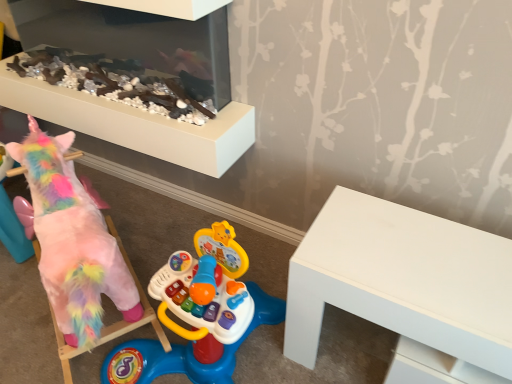
Question: Is fluffy pink unicorn at left thinner than smooth white fireplace at upper center?

Choices:
 (A) no
 (B) yes

Answer: (A)

Question: Can you confirm if fluffy pink unicorn at left is shorter than smooth white fireplace at upper center?

Choices:
 (A) no
 (B) yes

Answer: (A)

Question: Is the depth of fluffy pink unicorn at left less than that of smooth white fireplace at upper center?

Choices:
 (A) no
 (B) yes

Answer: (B)

Question: Is fluffy pink unicorn at left in contact with smooth white fireplace at upper center?

Choices:
 (A) no
 (B) yes

Answer: (A)

Question: Considering the relative positions of fluffy pink unicorn at left and smooth white fireplace at upper center in the image provided, is fluffy pink unicorn at left behind smooth white fireplace at upper center?

Choices:
 (A) yes
 (B) no

Answer: (B)

Question: Does fluffy pink unicorn at left turn towards smooth white fireplace at upper center?

Choices:
 (A) yes
 (B) no

Answer: (B)

Question: From the image's perspective, is white matte table at right over fluffy pink unicorn at left?

Choices:
 (A) yes
 (B) no

Answer: (B)

Question: Is white matte table at right aimed at fluffy pink unicorn at left?

Choices:
 (A) no
 (B) yes

Answer: (A)

Question: Can you confirm if white matte table at right is bigger than fluffy pink unicorn at left?

Choices:
 (A) no
 (B) yes

Answer: (A)

Question: Can you confirm if white matte table at right is smaller than fluffy pink unicorn at left?

Choices:
 (A) yes
 (B) no

Answer: (A)

Question: Does white matte table at right have a greater width compared to fluffy pink unicorn at left?

Choices:
 (A) yes
 (B) no

Answer: (A)

Question: Is white matte table at right directly adjacent to fluffy pink unicorn at left?

Choices:
 (A) yes
 (B) no

Answer: (B)

Question: Could you tell me if smooth white fireplace at upper center is turned towards fluffy pink unicorn at left?

Choices:
 (A) yes
 (B) no

Answer: (A)